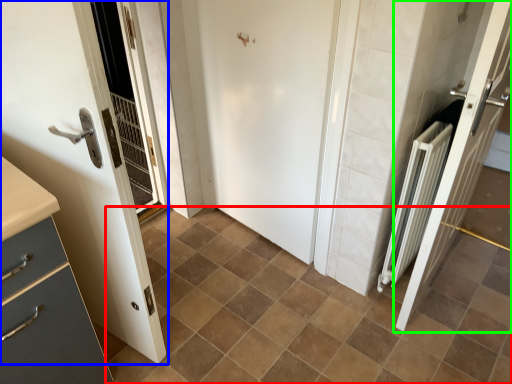
Question: Based on their relative distances, which object is farther from ceramic tile (highlighted by a red box)? Choose from door (highlighted by a blue box) and door (highlighted by a green box).

Choices:
 (A) door
 (B) door

Answer: (A)